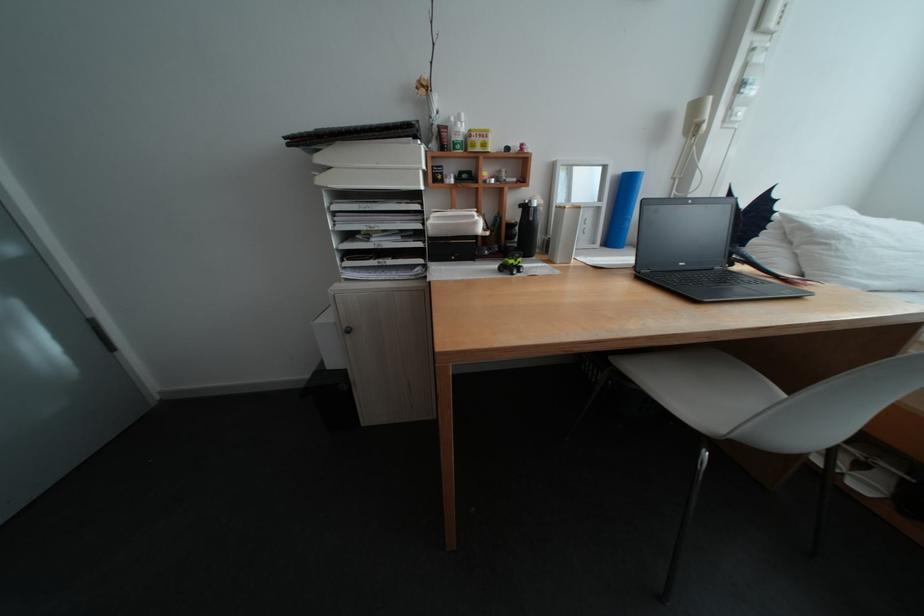
Find where to lift the yellow lidded container. Please return your answer as a coordinate pair (x, y).

(478, 140)